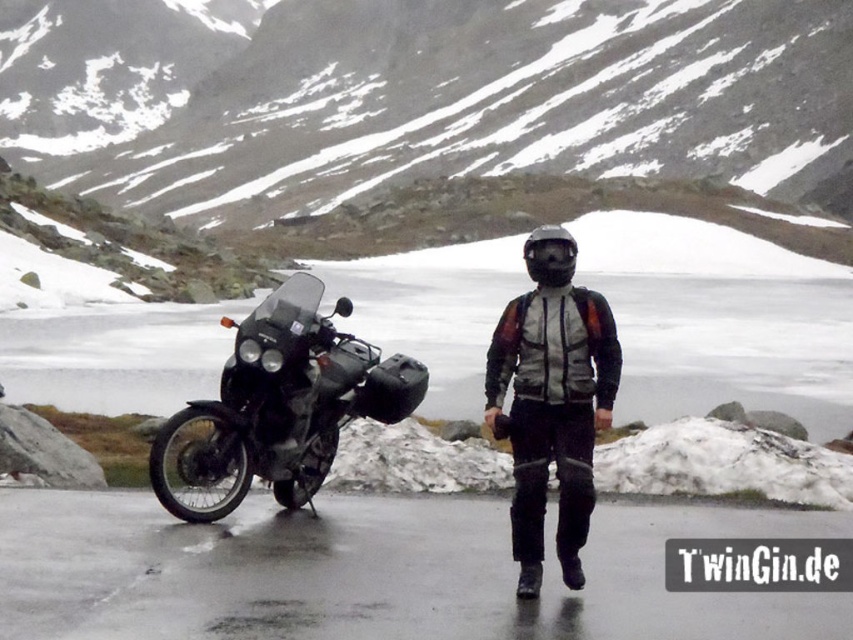
You are a hiker planning to cross the snowy terrain in the image. You see the snowy rock at center. Based on its position, would you consider this rock a potential obstacle for your path?

The snowy rock at center is located at point (415,96), so yes, it would be a potential obstacle for your path as it is centrally positioned in the scene.

You are a photographer trying to capture a clear shot of the matte black motorcycle at left and the matte black jacket at center. Since both objects are matte black, you want to ensure they are distinguishable in the photo. Which object should you focus on first to ensure it appears in the foreground?

The matte black motorcycle at left is positioned under the matte black jacket at center, so focusing on the matte black jacket at center first will ensure it appears in the foreground.